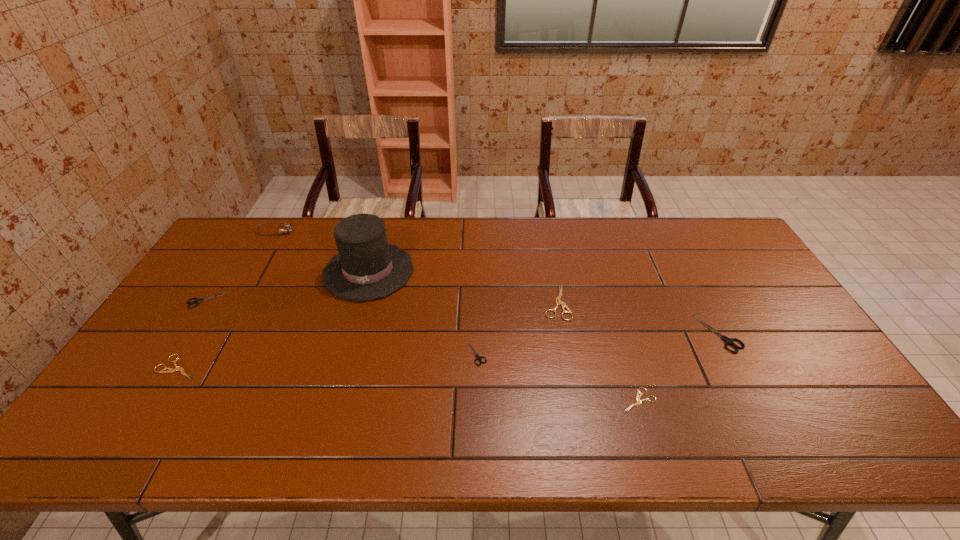
You are a GUI agent. You are given a task and a screenshot of the screen. Output one action in this format:
    pyautogui.click(x=<x>, y=<y>)
    Task: Click on the leftmost beige shears
    
    Given the screenshot: What is the action you would take?
    pyautogui.click(x=170, y=370)

This screenshot has width=960, height=540. Find the location of `the second biggest beige shears`. the second biggest beige shears is located at coordinates (170, 370).

You are a GUI agent. You are given a task and a screenshot of the screen. Output one action in this format:
    pyautogui.click(x=<x>, y=<y>)
    Task: Click on the third shears from left to right
    This screenshot has height=540, width=960.
    Given the screenshot: What is the action you would take?
    pyautogui.click(x=477, y=356)

I want to click on the smallest black shears, so click(477, 356).

Locate an element on the screen. The height and width of the screenshot is (540, 960). the nearest beige shears is located at coordinates (638, 397).

The height and width of the screenshot is (540, 960). In order to click on the smallest beige shears in this screenshot , I will do `click(638, 397)`.

Locate an element on the screen. This screenshot has height=540, width=960. vacant space situated on the front of the tallest object with the decoration is located at coordinates (x=355, y=318).

At what (x,y) coordinates should I click in order to perform the action: click on free location located on the front lenses and sides of the goggles. Please return your answer as a coordinate pair (x, y). Looking at the image, I should click on (339, 231).

Image resolution: width=960 pixels, height=540 pixels. I want to click on free spot located 0.200m on the left of the rightmost shears, so click(x=631, y=334).

Locate an element on the screen. This screenshot has height=540, width=960. vacant space situated 0.220m on the front of the leftmost black shears is located at coordinates (162, 370).